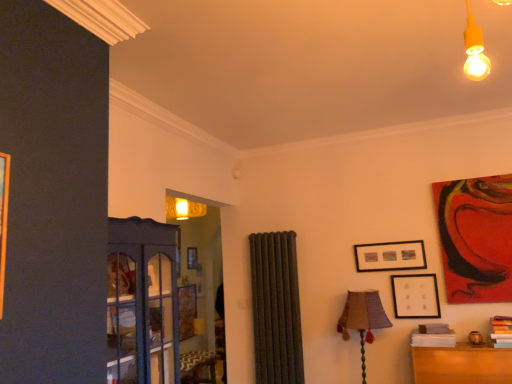
Question: Could you tell me if black matte picture frame at upper right, which is counted as the third picture frame, starting from the right, is turned towards matte black picture frame at lower right, the second picture frame viewed from the left?

Choices:
 (A) no
 (B) yes

Answer: (A)

Question: Is black matte picture frame at upper right, which is counted as the third picture frame, starting from the right, at the right side of matte black picture frame at lower right, marked as the second picture frame in a right-to-left arrangement?

Choices:
 (A) yes
 (B) no

Answer: (B)

Question: Is black matte picture frame at upper right, which is counted as the third picture frame, starting from the right, at the left side of matte black picture frame at lower right, the second picture frame viewed from the left?

Choices:
 (A) yes
 (B) no

Answer: (A)

Question: From the image's perspective, is black matte picture frame at upper right, which is counted as the third picture frame, starting from the right, on matte black picture frame at lower right, marked as the second picture frame in a right-to-left arrangement?

Choices:
 (A) yes
 (B) no

Answer: (A)

Question: Would you say black matte picture frame at upper right, marked as the first picture frame in a left-to-right arrangement, contains matte black picture frame at lower right, the second picture frame viewed from the left?

Choices:
 (A) no
 (B) yes

Answer: (A)

Question: From a real-world perspective, is black matte picture frame at upper right, marked as the first picture frame in a left-to-right arrangement, above or below burlap lampshade at center-right?

Choices:
 (A) above
 (B) below

Answer: (A)

Question: From the image's perspective, is black matte picture frame at upper right, marked as the first picture frame in a left-to-right arrangement, located above or below burlap lampshade at center-right?

Choices:
 (A) above
 (B) below

Answer: (A)

Question: Does point (408, 261) appear closer or farther from the camera than point (351, 301)?

Choices:
 (A) closer
 (B) farther

Answer: (B)

Question: In terms of height, does black matte picture frame at upper right, which is counted as the third picture frame, starting from the right, look taller or shorter compared to burlap lampshade at center-right?

Choices:
 (A) tall
 (B) short

Answer: (B)

Question: Considering the relative positions of black matte picture frame at upper right, marked as the first picture frame in a left-to-right arrangement, and matte black picture frame at lower right, the second picture frame viewed from the left, in the image provided, is black matte picture frame at upper right, marked as the first picture frame in a left-to-right arrangement, to the left or to the right of matte black picture frame at lower right, the second picture frame viewed from the left,?

Choices:
 (A) right
 (B) left

Answer: (B)

Question: Considering their positions, is black matte picture frame at upper right, marked as the first picture frame in a left-to-right arrangement, located in front of or behind matte black picture frame at lower right, marked as the second picture frame in a right-to-left arrangement?

Choices:
 (A) front
 (B) behind

Answer: (B)

Question: Based on their sizes in the image, would you say black matte picture frame at upper right, marked as the first picture frame in a left-to-right arrangement, is bigger or smaller than matte black picture frame at lower right, the second picture frame viewed from the left?

Choices:
 (A) big
 (B) small

Answer: (A)

Question: In terms of width, does black matte picture frame at upper right, marked as the first picture frame in a left-to-right arrangement, look wider or thinner when compared to matte black picture frame at lower right, marked as the second picture frame in a right-to-left arrangement?

Choices:
 (A) wide
 (B) thin

Answer: (A)

Question: From the image's perspective, is hardcover book at lower right, placed as the 1th book when sorted from right to left, above or below burlap lampshade at center-right?

Choices:
 (A) below
 (B) above

Answer: (B)

Question: Considering the positions of point click(509, 344) and point click(347, 327), is point click(509, 344) closer or farther from the camera than point click(347, 327)?

Choices:
 (A) closer
 (B) farther

Answer: (A)